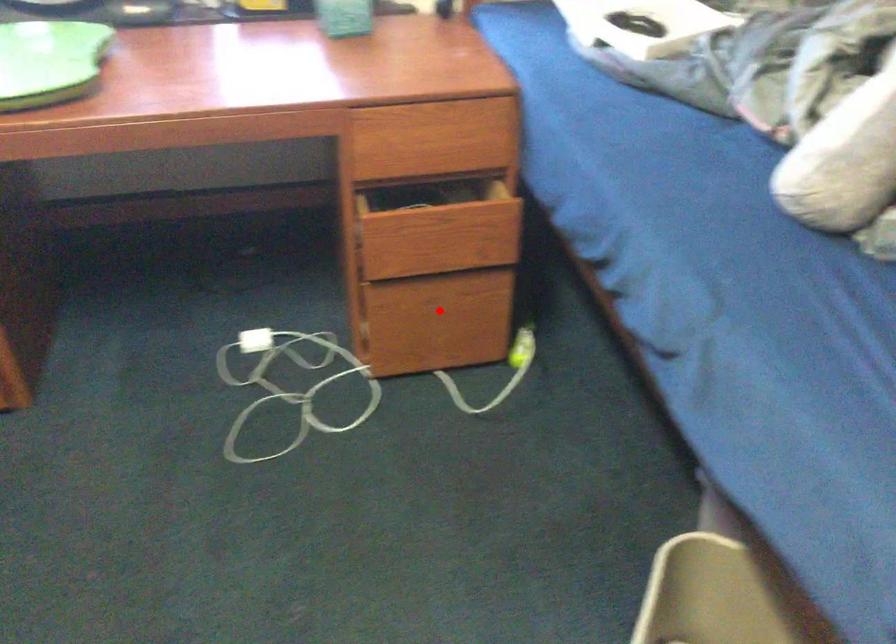
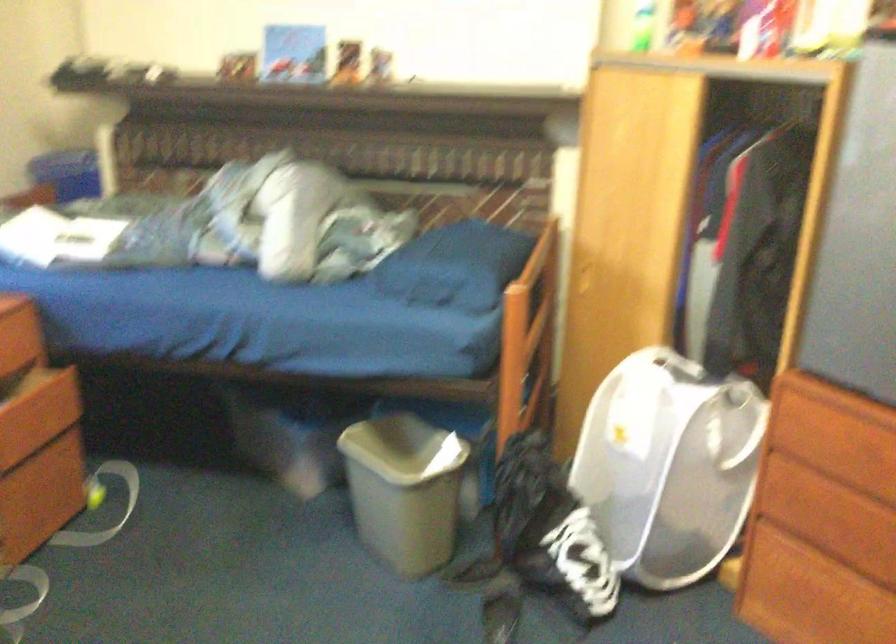
Question: I am providing you with two images of the same scene from different viewpoints. Given a red point in image1, look at the same physical point in image2. Is it:

Choices:
 (A) Closer to the viewpoint
 (B) Farther from the viewpoint

Answer: (B)